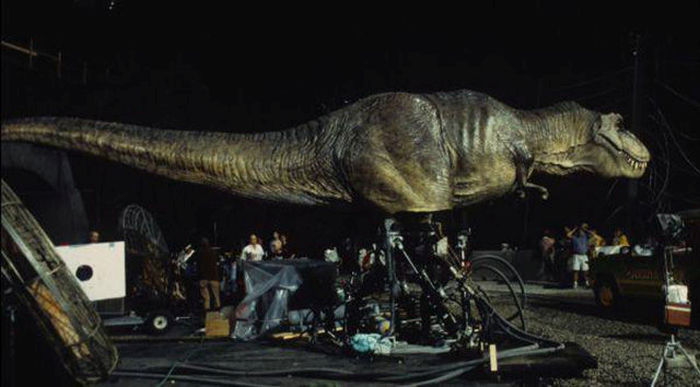
Find the location of a particular element. fan is located at coordinates (138, 230).